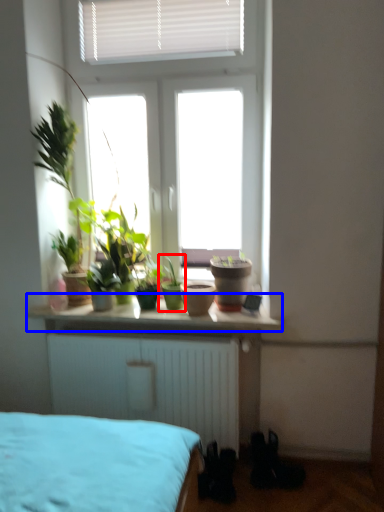
Question: Which of the following is the closest to the observer, houseplant (highlighted by a red box) or counter top (highlighted by a blue box)?

Choices:
 (A) houseplant
 (B) counter top

Answer: (B)